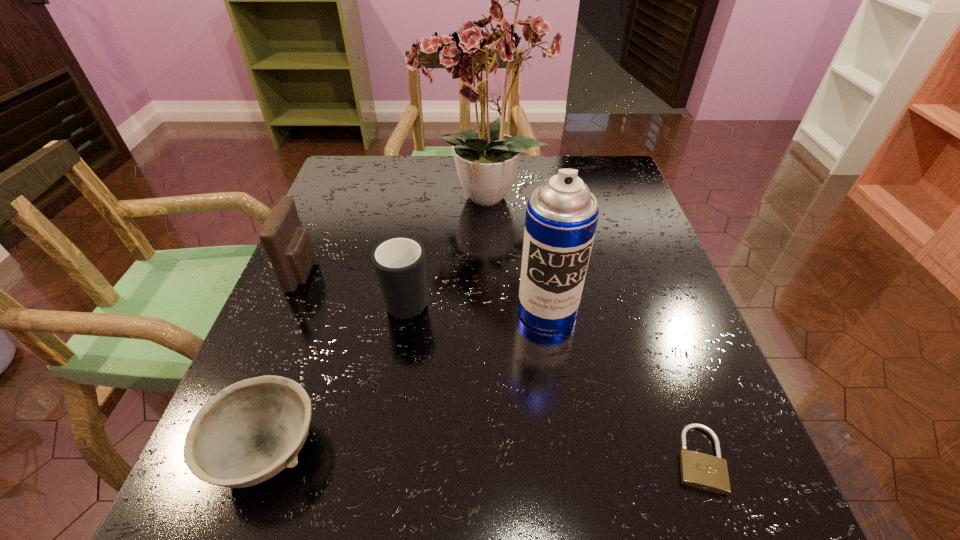
Where is `flower arrangement`? The height and width of the screenshot is (540, 960). flower arrangement is located at coordinates (489, 44).

Where is `the farthest object`? The image size is (960, 540). the farthest object is located at coordinates point(489,44).

Locate an element on the screen. aerosol can is located at coordinates pyautogui.click(x=561, y=218).

You are a GUI agent. You are given a task and a screenshot of the screen. Output one action in this format:
    pyautogui.click(x=<x>, y=<y>)
    Task: Click on the pouch
    The image size is (960, 540).
    Given the screenshot: What is the action you would take?
    pyautogui.click(x=288, y=245)

Identify the location of mug. (399, 262).

Where is `the second shortest object`? Image resolution: width=960 pixels, height=540 pixels. the second shortest object is located at coordinates (250, 431).

Identify the location of padlock. Image resolution: width=960 pixels, height=540 pixels. (698, 470).

Identify the location of the shortest object. This screenshot has height=540, width=960. (698, 470).

Find the location of a particular element. vacant space situated on the front-facing side of the flower arrangement is located at coordinates (371, 199).

Find the location of a particular element. The width and height of the screenshot is (960, 540). vacant area situated on the front-facing side of the flower arrangement is located at coordinates (378, 199).